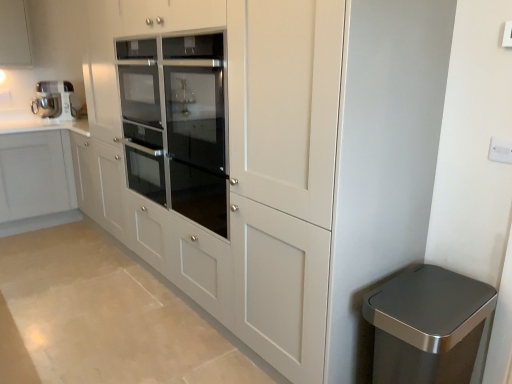
Question: Does matte white cabinet at upper left have a larger size compared to white plastic electric outlet at upper right?

Choices:
 (A) yes
 (B) no

Answer: (A)

Question: From a real-world perspective, is matte white cabinet at upper left physically above white plastic electric outlet at upper right?

Choices:
 (A) yes
 (B) no

Answer: (A)

Question: Is matte white cabinet at upper left not close to white plastic electric outlet at upper right?

Choices:
 (A) yes
 (B) no

Answer: (A)

Question: From a real-world perspective, is matte white cabinet at upper left located beneath white plastic electric outlet at upper right?

Choices:
 (A) no
 (B) yes

Answer: (A)

Question: Considering the relative sizes of matte white cabinet at upper left and white plastic electric outlet at upper right in the image provided, is matte white cabinet at upper left thinner than white plastic electric outlet at upper right?

Choices:
 (A) yes
 (B) no

Answer: (B)

Question: Is point (53, 89) positioned closer to the camera than point (502, 147)?

Choices:
 (A) closer
 (B) farther

Answer: (B)

Question: Based on their sizes in the image, would you say metallic silver mixer at upper left is bigger or smaller than white plastic electric outlet at upper right?

Choices:
 (A) small
 (B) big

Answer: (B)

Question: In terms of height, does metallic silver mixer at upper left look taller or shorter compared to white plastic electric outlet at upper right?

Choices:
 (A) short
 (B) tall

Answer: (B)

Question: Is metallic silver mixer at upper left in front of or behind white plastic electric outlet at upper right in the image?

Choices:
 (A) behind
 (B) front

Answer: (A)

Question: In terms of size, does metallic silver mixer at upper left appear bigger or smaller than satin silver trash can at lower right?

Choices:
 (A) big
 (B) small

Answer: (B)

Question: Considering their positions, is metallic silver mixer at upper left located in front of or behind satin silver trash can at lower right?

Choices:
 (A) behind
 (B) front

Answer: (A)

Question: From a real-world perspective, is metallic silver mixer at upper left positioned above or below satin silver trash can at lower right?

Choices:
 (A) below
 (B) above

Answer: (B)

Question: Is metallic silver mixer at upper left inside or outside of satin silver trash can at lower right?

Choices:
 (A) inside
 (B) outside

Answer: (B)

Question: From the image's perspective, is satin silver trash can at lower right positioned above or below white plastic electric outlet at upper right?

Choices:
 (A) above
 (B) below

Answer: (B)

Question: Choose the correct answer: Is satin silver trash can at lower right inside white plastic electric outlet at upper right or outside it?

Choices:
 (A) outside
 (B) inside

Answer: (A)